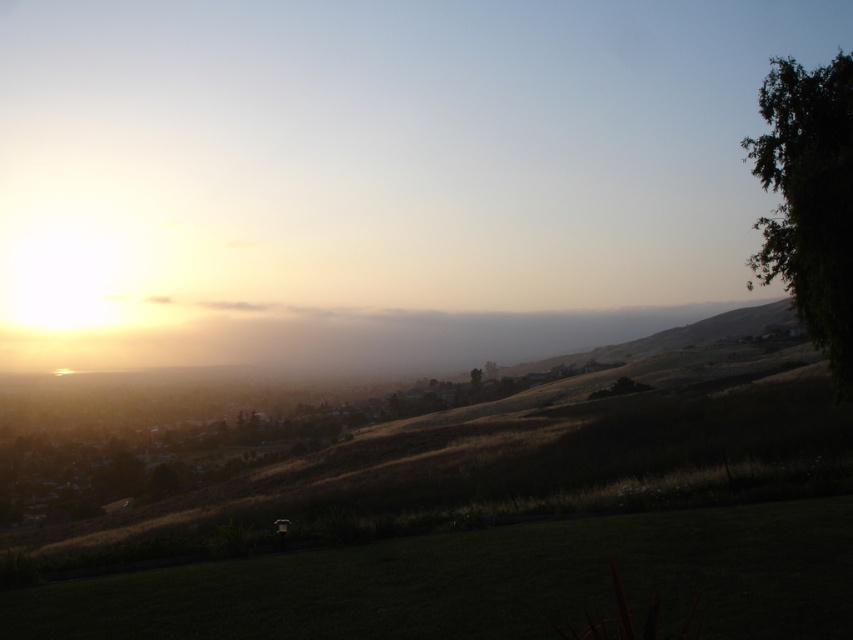
You are a gardener planning to plant a new row of flowers between the green grassy at lower center and the green leafy tree at right. Since the grassy area is narrower than the tree, which object should you consider for spacing your flowers more closely?

The green grassy at lower center has a smaller width compared to the green leafy tree at right, so you should plant the flowers closer together near the green grassy at lower center to accommodate its narrower space.

You are a gardener who wants to place a new bench between the green grassy at lower center and the green leafy tree at right. The bench is 2 meters long. Is there enough space between them to place the bench without moving either object?

The distance between the green grassy at lower center and the green leafy tree at right is 12.17 meters. Since the bench is only 2 meters long, there is more than enough space to place it between them without needing to move either object.

You are standing in the middle of the grassy area in the sunset scene. There is a point marked at coordinates point (485,582). Is this point located in the green grassy area at lower center?

Yes, the point (485,582) is located in the green grassy area at lower center as stated in the objects description.